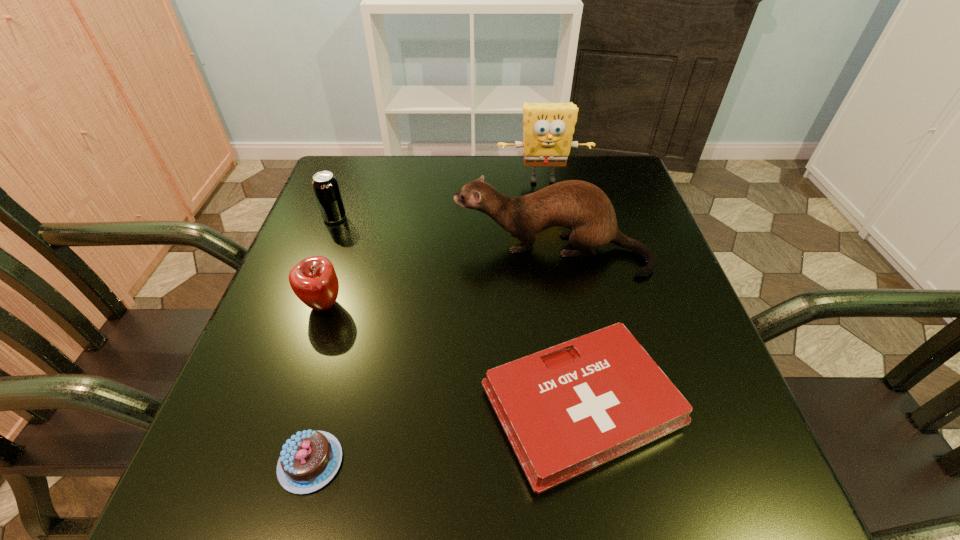
Find the location of a particular element. Image resolution: width=960 pixels, height=540 pixels. the tallest object is located at coordinates (548, 129).

Locate an element on the screen. Image resolution: width=960 pixels, height=540 pixels. sponge is located at coordinates (548, 129).

Where is `the second tallest object`? The image size is (960, 540). the second tallest object is located at coordinates (582, 207).

At what (x,y) coordinates should I click in order to perform the action: click on the fourth nearest object. Please return your answer as a coordinate pair (x, y). This screenshot has height=540, width=960. Looking at the image, I should click on (582, 207).

Locate an element on the screen. This screenshot has width=960, height=540. soda can is located at coordinates (325, 185).

Where is `the third nearest object`? the third nearest object is located at coordinates (314, 281).

You are a GUI agent. You are given a task and a screenshot of the screen. Output one action in this format:
    pyautogui.click(x=<x>, y=<y>)
    Task: Click on the first-aid kit
    The image size is (960, 540).
    Given the screenshot: What is the action you would take?
    pyautogui.click(x=568, y=409)

Locate an element on the screen. This screenshot has height=540, width=960. chocolate cake is located at coordinates (310, 459).

Identify the location of blank space located 0.090m on the face of the tallest object. (548, 212).

Locate an element on the screen. This screenshot has width=960, height=540. free space located 0.190m at the face of the third farthest object is located at coordinates (367, 252).